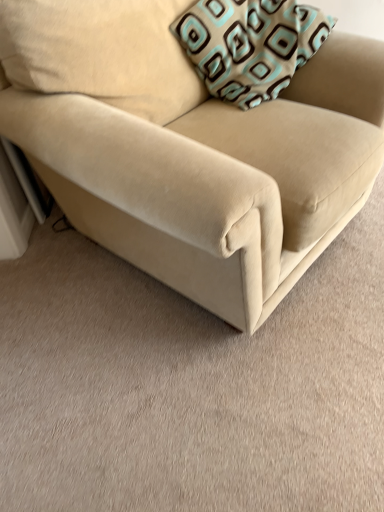
Question: Which is correct: beige fabric couch at center is inside teal-patterned fabric pillow at upper right, or outside of it?

Choices:
 (A) inside
 (B) outside

Answer: (B)

Question: Is beige fabric couch at center taller or shorter than teal-patterned fabric pillow at upper right?

Choices:
 (A) short
 (B) tall

Answer: (B)

Question: Is point (132, 59) closer or farther from the camera than point (231, 9)?

Choices:
 (A) farther
 (B) closer

Answer: (B)

Question: Is teal-patterned fabric pillow at upper right bigger or smaller than beige fabric couch at center?

Choices:
 (A) small
 (B) big

Answer: (A)

Question: Looking at their shapes, would you say teal-patterned fabric pillow at upper right is wider or thinner than beige fabric couch at center?

Choices:
 (A) thin
 (B) wide

Answer: (A)

Question: In the image, is teal-patterned fabric pillow at upper right on the left side or the right side of beige fabric couch at center?

Choices:
 (A) left
 (B) right

Answer: (B)

Question: Is teal-patterned fabric pillow at upper right inside the boundaries of beige fabric couch at center, or outside?

Choices:
 (A) inside
 (B) outside

Answer: (A)